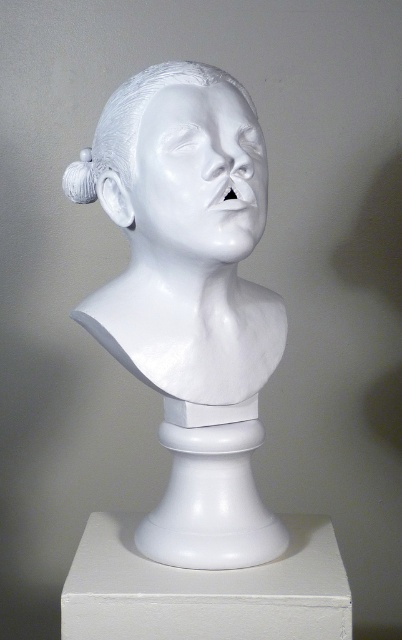
Question: Among these points, which one is farthest from the camera?

Choices:
 (A) (264, 216)
 (B) (141, 589)

Answer: (A)

Question: Is white glossy bust at center to the left of white marble pedestal at center from the viewer's perspective?

Choices:
 (A) yes
 (B) no

Answer: (A)

Question: Which object is closer to the camera taking this photo?

Choices:
 (A) white glossy bust at center
 (B) white glossy hair at center
 (C) white marble pedestal at center
 (D) white glossy sculpture at center

Answer: (C)

Question: Which of these objects is positioned closest to the white glossy hair at center?

Choices:
 (A) white glossy sculpture at center
 (B) white marble pedestal at center
 (C) white glossy bust at center

Answer: (A)

Question: Is white glossy bust at center above white glossy sculpture at center?

Choices:
 (A) no
 (B) yes

Answer: (A)

Question: Is white glossy bust at center above white glossy hair at center?

Choices:
 (A) yes
 (B) no

Answer: (B)